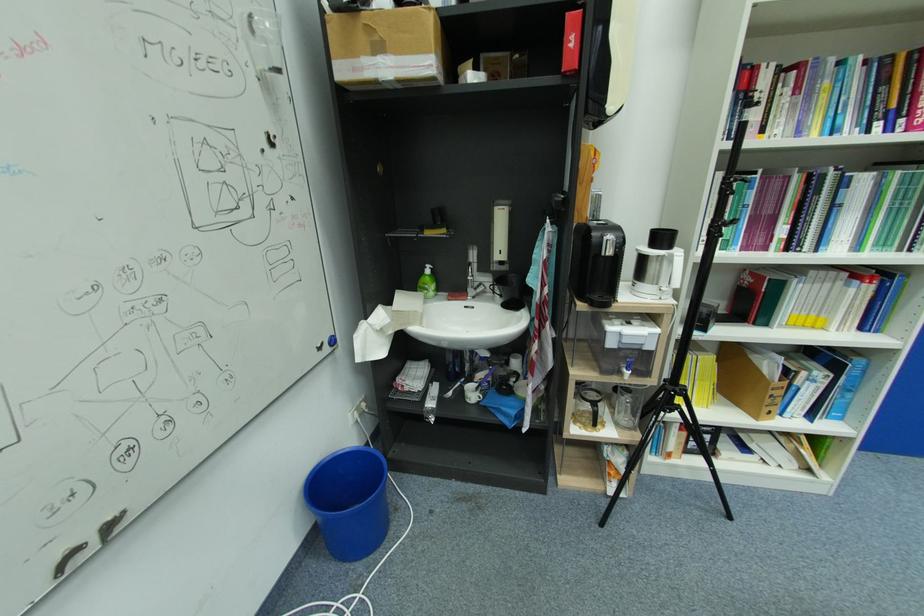
Image resolution: width=924 pixels, height=616 pixels. I want to click on blue dispenser spigot, so pyautogui.click(x=627, y=359).